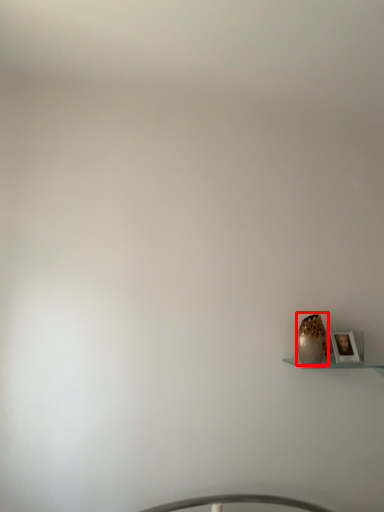
Question: Observing the image, what is the correct spatial positioning of vase (annotated by the red box) in reference to picture frame?

Choices:
 (A) right
 (B) left

Answer: (B)